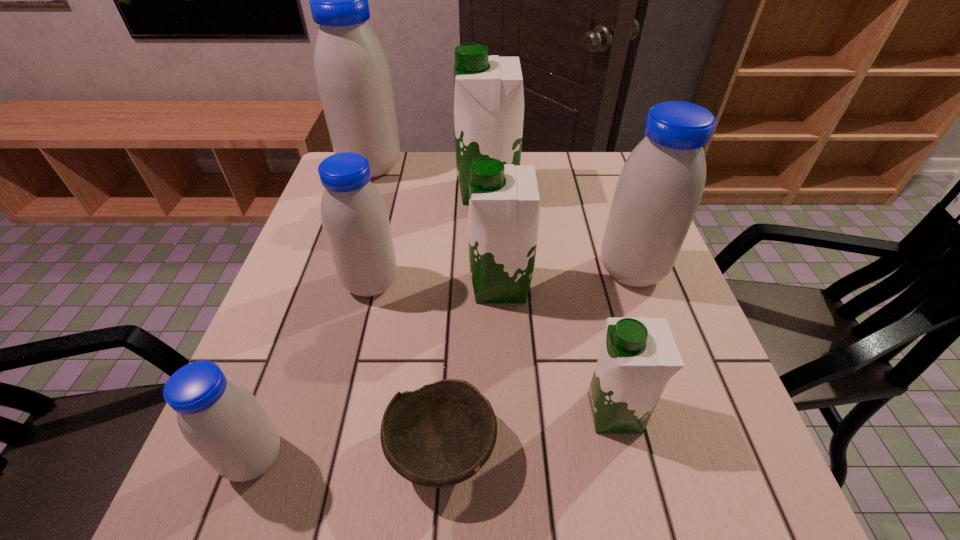
Where is `blank area in the image that satisfies the following two spatial constraints: 1. on the back side of the third biggest blue soya milk; 2. on the left side of the rightmost blue soya milk`? The image size is (960, 540). blank area in the image that satisfies the following two spatial constraints: 1. on the back side of the third biggest blue soya milk; 2. on the left side of the rightmost blue soya milk is located at coordinates (374, 271).